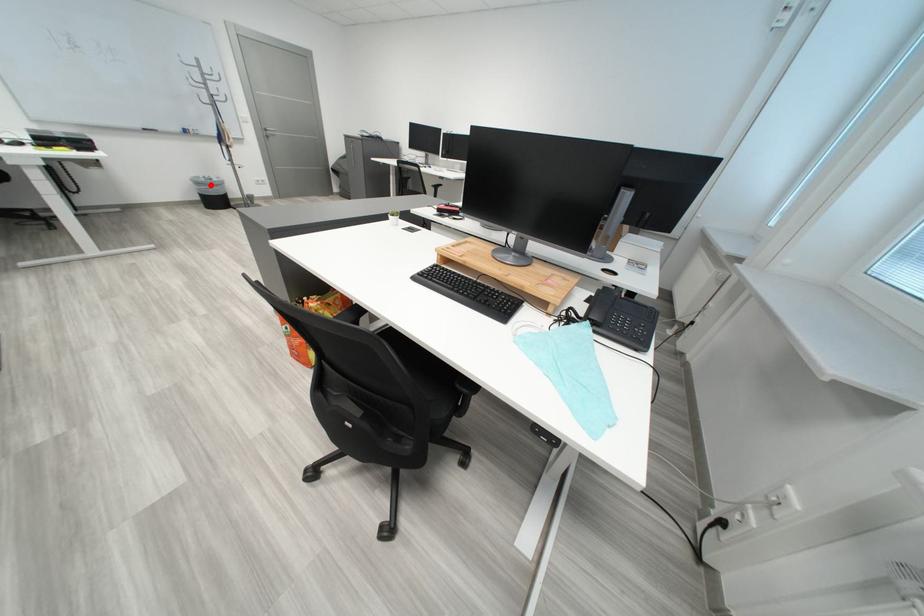
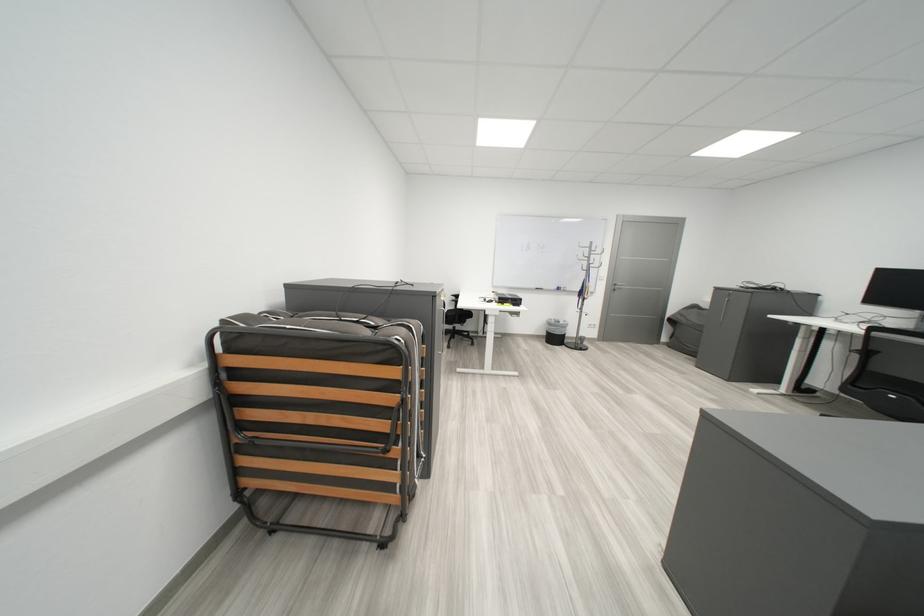
Where in the second image is the point corresponding to the highlighted location from the first image?

(563, 326)